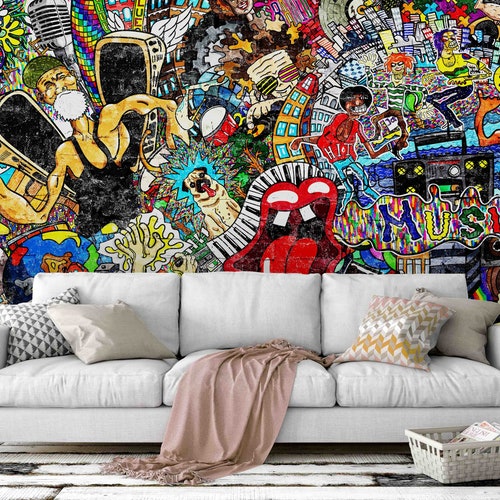
At what (x,y) coordinates should I click in order to perform the action: click on pillows. Please return your answer as a coordinate pair (x, y). The width and height of the screenshot is (500, 500). Looking at the image, I should click on (464, 330), (399, 331), (91, 323), (35, 333).